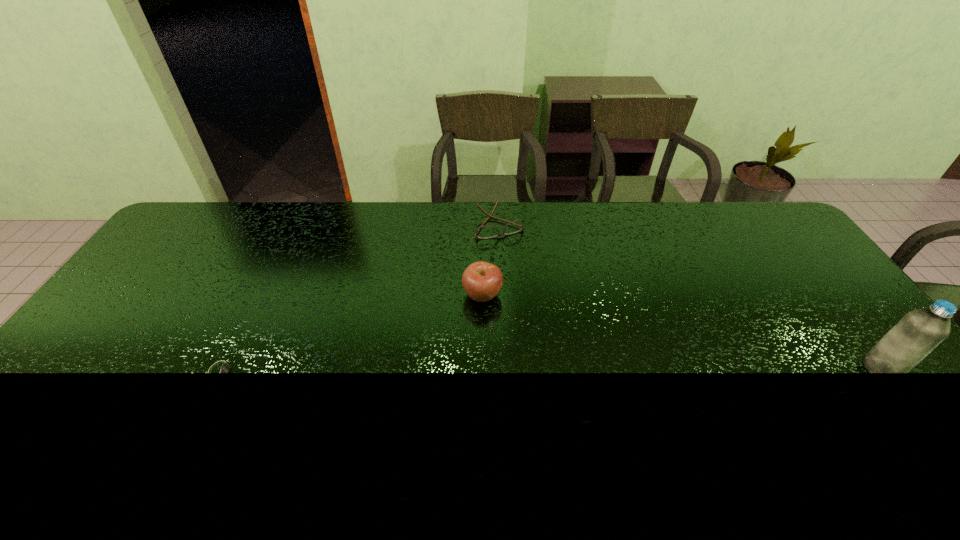
Identify the location of free space at the near edge of the desktop. Image resolution: width=960 pixels, height=540 pixels. (802, 387).

Locate an element on the screen. This screenshot has width=960, height=540. vacant region at the left edge of the desktop is located at coordinates tap(198, 249).

Locate an element on the screen. vacant space at the right edge of the desktop is located at coordinates (841, 304).

Image resolution: width=960 pixels, height=540 pixels. Find the location of `vacant space at the far left corner`. vacant space at the far left corner is located at coordinates (184, 235).

Image resolution: width=960 pixels, height=540 pixels. In order to click on free point between the water bottle and the spectacles in this screenshot , I will do `click(690, 296)`.

Where is `free space between the leftmost object and the second tallest object`? The width and height of the screenshot is (960, 540). free space between the leftmost object and the second tallest object is located at coordinates (x=350, y=333).

The image size is (960, 540). What are the coordinates of `vacant space that is in between the leftmost object and the rightmost object` in the screenshot? It's located at (550, 370).

Locate an element on the screen. The image size is (960, 540). free space that is in between the leftmost object and the tallest object is located at coordinates (550, 370).

You are a GUI agent. You are given a task and a screenshot of the screen. Output one action in this format:
    pyautogui.click(x=<x>, y=<y>)
    Task: Click on the free space between the leftmost object and the tallest object
    
    Given the screenshot: What is the action you would take?
    pyautogui.click(x=550, y=370)

Image resolution: width=960 pixels, height=540 pixels. I want to click on free space between the leftmost object and the second farthest object, so click(x=350, y=333).